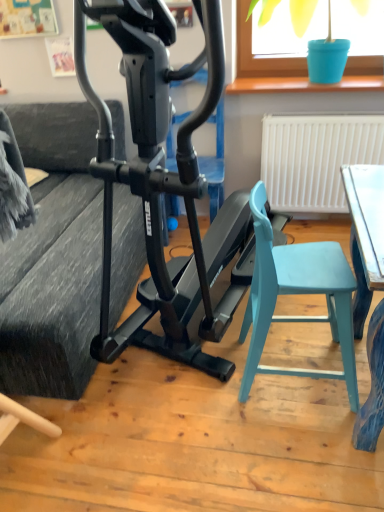
Question: From the image's perspective, is light blue plastic chair at lower right located beneath black matte stationary bicycle at center?

Choices:
 (A) yes
 (B) no

Answer: (A)

Question: Is light blue plastic chair at lower right shorter than black matte stationary bicycle at center?

Choices:
 (A) yes
 (B) no

Answer: (A)

Question: Considering the relative sizes of light blue plastic chair at lower right and black matte stationary bicycle at center in the image provided, is light blue plastic chair at lower right wider than black matte stationary bicycle at center?

Choices:
 (A) no
 (B) yes

Answer: (A)

Question: Is light blue plastic chair at lower right closer to the viewer compared to black matte stationary bicycle at center?

Choices:
 (A) yes
 (B) no

Answer: (B)

Question: Is light blue plastic chair at lower right with black matte stationary bicycle at center?

Choices:
 (A) yes
 (B) no

Answer: (B)

Question: In terms of width, does blue plastic bucket at upper right look wider or thinner when compared to black matte stationary bicycle at center?

Choices:
 (A) wide
 (B) thin

Answer: (B)

Question: Is point click(x=284, y=57) positioned closer to the camera than point click(x=102, y=324)?

Choices:
 (A) closer
 (B) farther

Answer: (B)

Question: Considering their positions, is blue plastic bucket at upper right located in front of or behind black matte stationary bicycle at center?

Choices:
 (A) behind
 (B) front

Answer: (A)

Question: Considering the positions of blue plastic bucket at upper right and black matte stationary bicycle at center in the image, is blue plastic bucket at upper right bigger or smaller than black matte stationary bicycle at center?

Choices:
 (A) big
 (B) small

Answer: (B)

Question: Considering the positions of point (109, 340) and point (241, 51), is point (109, 340) closer or farther from the camera than point (241, 51)?

Choices:
 (A) farther
 (B) closer

Answer: (B)

Question: Looking at their shapes, would you say black matte stationary bicycle at center is wider or thinner than blue plastic bucket at upper right?

Choices:
 (A) wide
 (B) thin

Answer: (A)

Question: Which is correct: black matte stationary bicycle at center is inside blue plastic bucket at upper right, or outside of it?

Choices:
 (A) inside
 (B) outside

Answer: (B)

Question: From a real-world perspective, relative to blue plastic bucket at upper right, is black matte stationary bicycle at center vertically above or below?

Choices:
 (A) above
 (B) below

Answer: (B)

Question: In terms of width, does light blue plastic chair at lower right look wider or thinner when compared to black matte stationary bicycle at center?

Choices:
 (A) thin
 (B) wide

Answer: (A)

Question: Would you say light blue plastic chair at lower right is to the left or to the right of black matte stationary bicycle at center in the picture?

Choices:
 (A) left
 (B) right

Answer: (B)